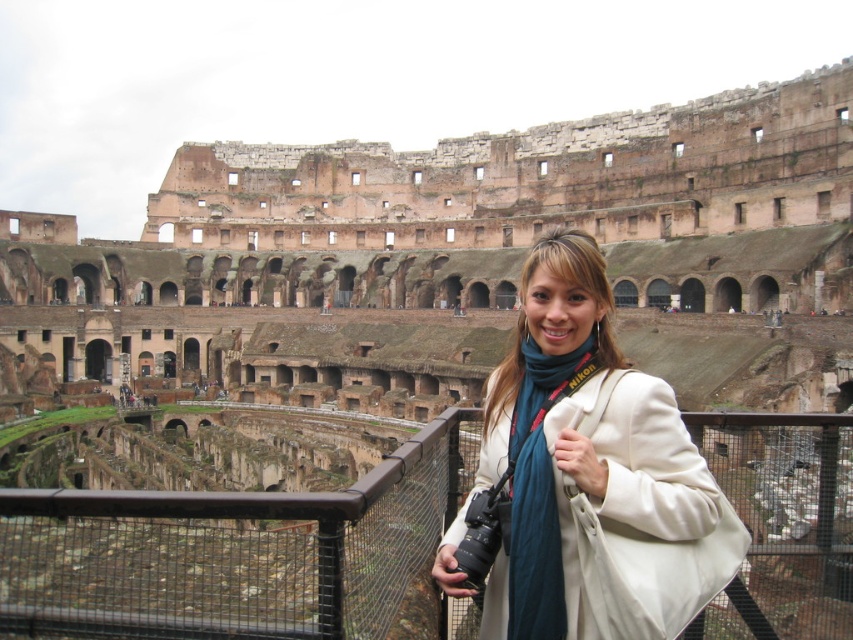
The width and height of the screenshot is (853, 640). I want to click on white fabric jacket at center, so click(576, 484).

Can you confirm if white fabric jacket at center is positioned below white fabric at center?

No, white fabric jacket at center is not below white fabric at center.

At what (x,y) coordinates should I click in order to perform the action: click on white fabric jacket at center. Please return your answer as a coordinate pair (x, y). Looking at the image, I should click on (576, 484).

Is black metal fence at lower center above white fabric jacket at center?

Incorrect, black metal fence at lower center is not positioned above white fabric jacket at center.

From the picture: Does black metal fence at lower center appear on the left side of white fabric jacket at center?

Yes, black metal fence at lower center is to the left of white fabric jacket at center.

Is point (743, 595) behind point (701, 573)?

Yes, point (743, 595) is farther from viewer.

Where is `black metal fence at lower center`? The width and height of the screenshot is (853, 640). black metal fence at lower center is located at coordinates (231, 552).

Is black metal fence at lower center closer to camera compared to white fabric at center?

Yes, black metal fence at lower center is in front of white fabric at center.

You are a GUI agent. You are given a task and a screenshot of the screen. Output one action in this format:
    pyautogui.click(x=<x>, y=<y>)
    Task: Click on the black metal fence at lower center
    Image resolution: width=853 pixels, height=640 pixels.
    Given the screenshot: What is the action you would take?
    click(231, 552)

Who is more distant from viewer, [45,506] or [583,477]?

The point [583,477] is more distant.

The image size is (853, 640). Identify the location of black metal fence at lower center. (x=231, y=552).